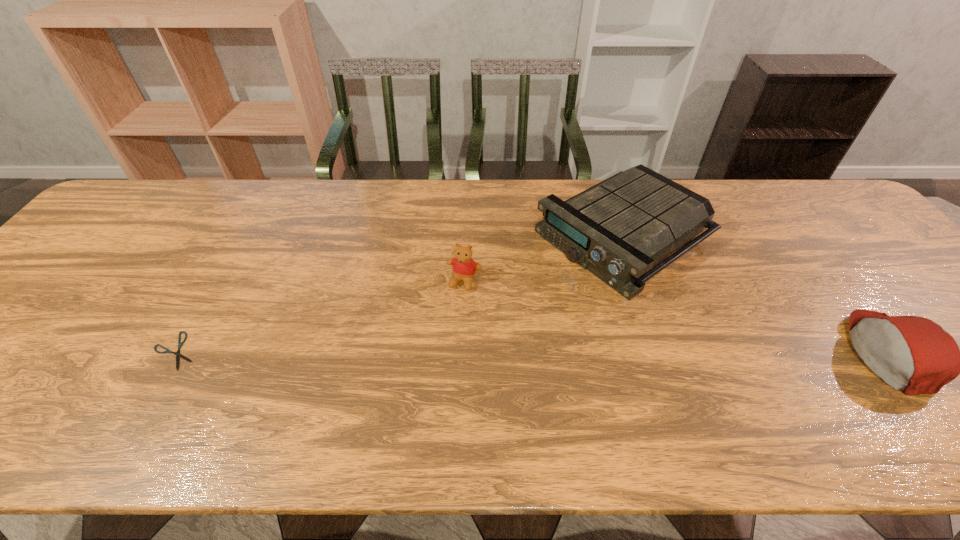
Where is `the shortest object`? This screenshot has width=960, height=540. the shortest object is located at coordinates (180, 344).

Identify the location of shears. (180, 344).

This screenshot has height=540, width=960. I want to click on the third object from left to right, so click(x=618, y=229).

Locate an element on the screen. The height and width of the screenshot is (540, 960). teddy bear is located at coordinates (464, 267).

I want to click on vacant space situated on the back of the shortest object, so click(x=239, y=241).

Locate an element on the screen. The height and width of the screenshot is (540, 960). vacant space located 0.130m on the front panel of the radio receiver is located at coordinates (524, 296).

At what (x,y) coordinates should I click in order to perform the action: click on free point located 0.250m on the front panel of the radio receiver. Please return your answer as a coordinate pair (x, y). This screenshot has height=540, width=960. Looking at the image, I should click on (487, 319).

What are the coordinates of `free space located on the front panel of the radio receiver` in the screenshot? It's located at (527, 294).

Find the location of `vacant space situated 0.200m on the front-facing side of the teddy bear`. vacant space situated 0.200m on the front-facing side of the teddy bear is located at coordinates (435, 357).

The image size is (960, 540). Find the location of `vacant region located on the front-facing side of the teddy bear`. vacant region located on the front-facing side of the teddy bear is located at coordinates (452, 313).